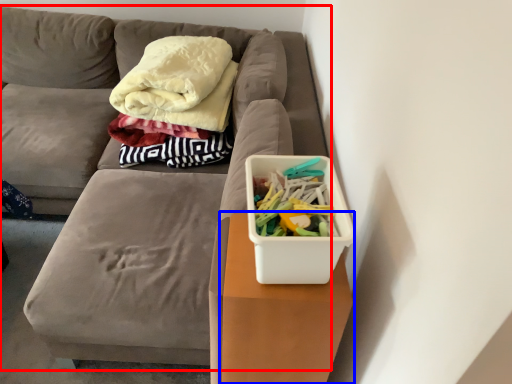
Question: Which object appears farthest to the camera in this image, furniture (highlighted by a red box) or table (highlighted by a blue box)?

Choices:
 (A) furniture
 (B) table

Answer: (A)